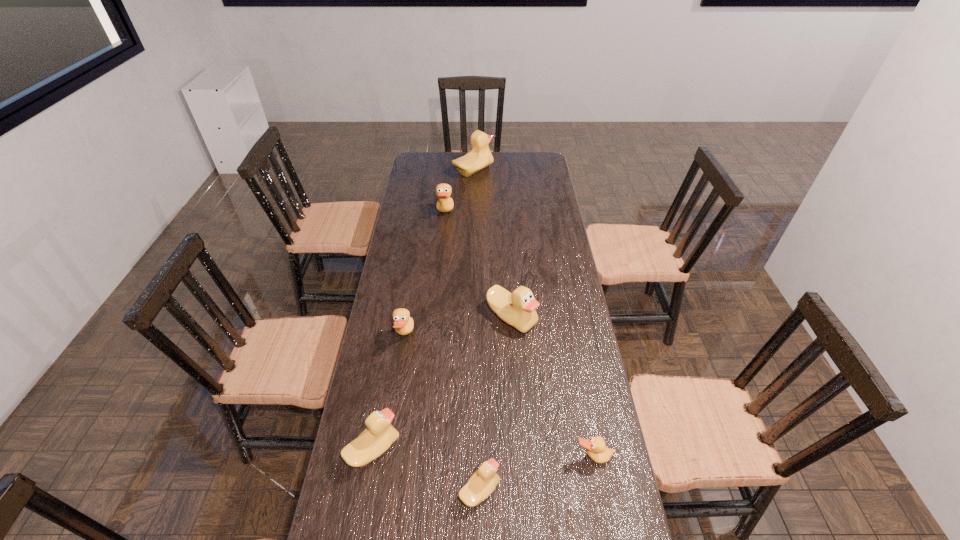
Locate an element on the screen. unoccupied position between the third biggest beige duck and the rightmost tan duck is located at coordinates 484,453.

Point out which object is positioned as the sixth nearest to the sixth nearest object. Please provide its 2D coordinates. Your answer should be formatted as a tuple, i.e. [(x, y)], where the tuple contains the x and y coordinates of a point satisfying the conditions above.

[(596, 449)]

Choose which object is the third nearest neighbor to the farthest duck. Please provide its 2D coordinates. Your answer should be formatted as a tuple, i.e. [(x, y)], where the tuple contains the x and y coordinates of a point satisfying the conditions above.

[(403, 323)]

At what (x,y) coordinates should I click in order to perform the action: click on duck that stands as the fifth closest to the farthest beige duck. Please return your answer as a coordinate pair (x, y). Looking at the image, I should click on (596, 449).

Where is `duck that is the fifth closest to the farthest duck`? The height and width of the screenshot is (540, 960). duck that is the fifth closest to the farthest duck is located at coordinates (596, 449).

The height and width of the screenshot is (540, 960). Identify the location of beige duck object that ranks as the closest to the third biggest beige duck. (482, 483).

Select which beige duck is the fourth closest to the leftmost tan duck. Please provide its 2D coordinates. Your answer should be formatted as a tuple, i.e. [(x, y)], where the tuple contains the x and y coordinates of a point satisfying the conditions above.

[(480, 157)]

This screenshot has height=540, width=960. In order to click on tan duck that can be found as the closest to the rightmost tan duck in this screenshot , I will do `click(403, 323)`.

Where is `tan duck that is the closest one to the biggest tan duck`? tan duck that is the closest one to the biggest tan duck is located at coordinates (403, 323).

I want to click on free region that satisfies the following two spatial constraints: 1. at the beak of the second farthest beige duck; 2. at the beak of the smallest beige duck, so click(523, 490).